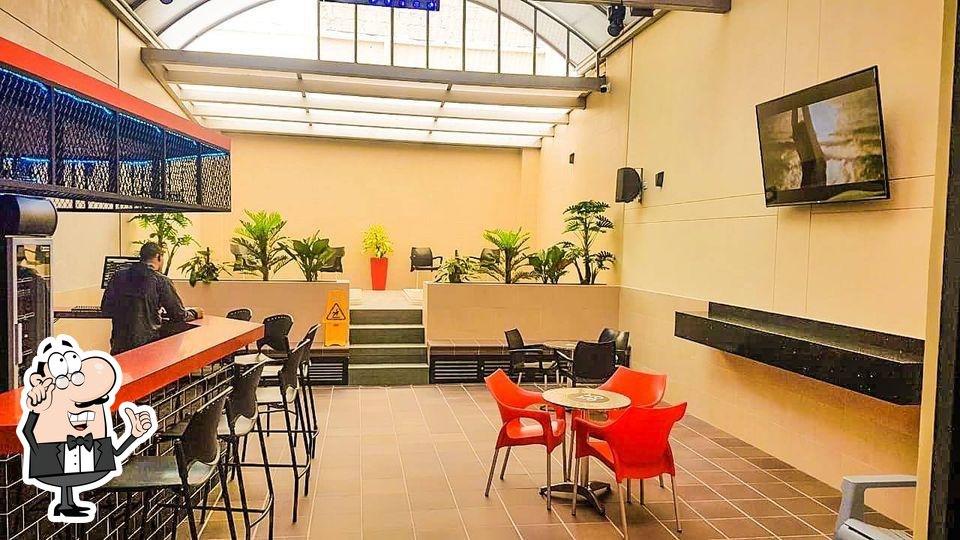
Identify the location of orange plastic chairs. The image size is (960, 540). (632, 421), (501, 391), (636, 383).